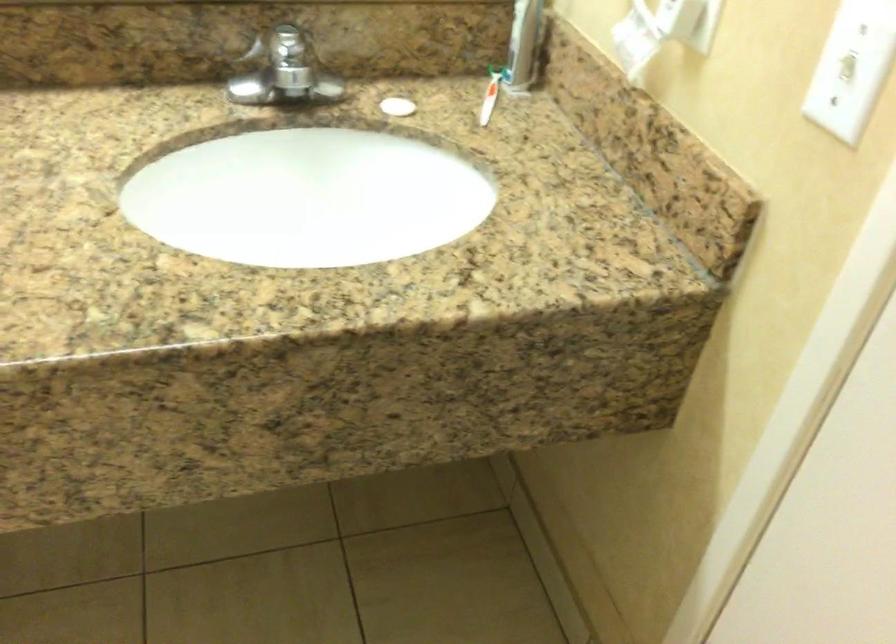
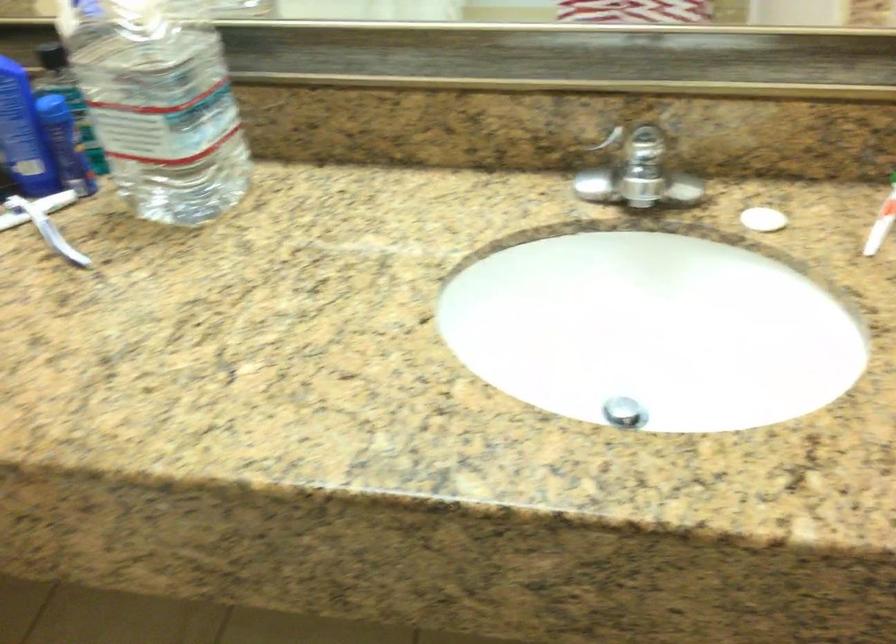
Question: The images are taken continuously from a first-person perspective. In which direction are you moving?

Choices:
 (A) Left
 (B) Right
 (C) Forward
 (D) Backward

Answer: (C)